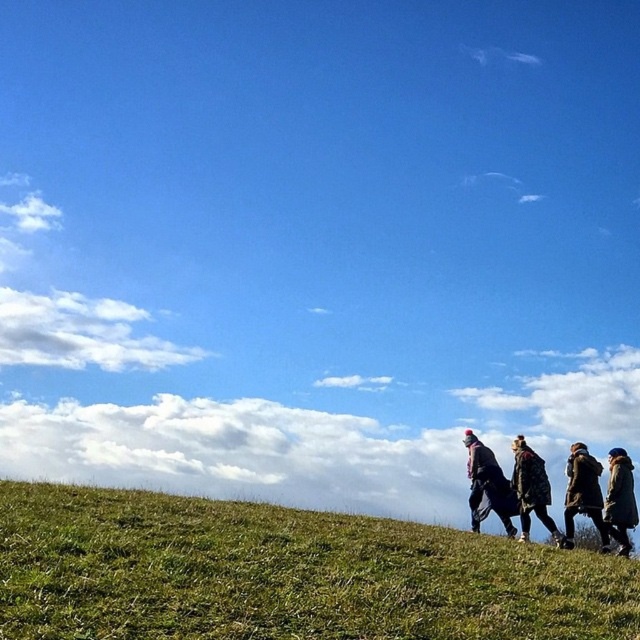
You are standing on the grassy hill and want to find the dark blue coat at right and the camouflage jacket at lower right. Which one is higher up on the slope?

The dark blue coat at right is above the camouflage jacket at lower right, so it is higher up on the slope.